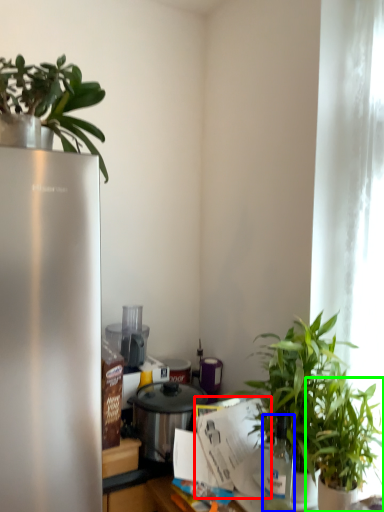
Question: Based on their relative distances, which object is nearer to paper (highlighted by a red box)? Choose from bottle (highlighted by a blue box) and houseplant (highlighted by a green box).

Choices:
 (A) bottle
 (B) houseplant

Answer: (A)